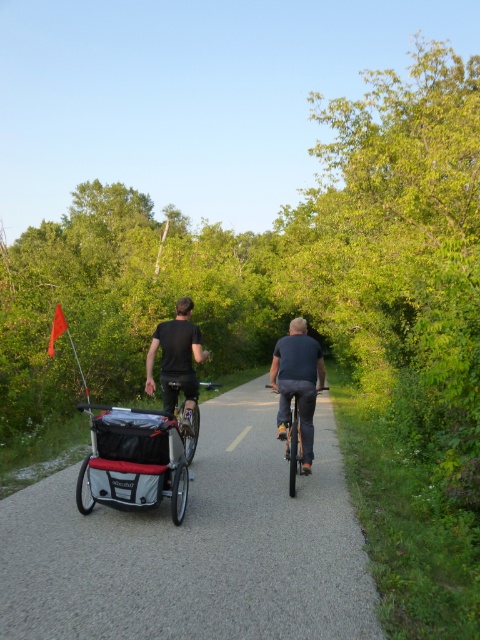
Question: Does shiny black bicycle at center have a greater width compared to shiny metallic bicycle at center?

Choices:
 (A) no
 (B) yes

Answer: (A)

Question: Is black matte shirt at center to the right of shiny black bicycle at center from the viewer's perspective?

Choices:
 (A) no
 (B) yes

Answer: (A)

Question: Which object appears farthest from the camera in this image?

Choices:
 (A) black matte shirt at center
 (B) black plastic cart at center
 (C) silver metallic cart at center
 (D) shiny metallic bicycle at center

Answer: (A)

Question: Does dark blue fabric shirt at center appear over shiny metallic bicycle at center?

Choices:
 (A) yes
 (B) no

Answer: (A)

Question: Which point is closer to the camera?

Choices:
 (A) dark blue fabric shirt at center
 (B) shiny metallic bicycle at center
 (C) black matte shirt at center

Answer: (B)

Question: Which point is closer to the camera taking this photo?

Choices:
 (A) (292, 492)
 (B) (267, 593)
 (C) (128, 500)
 (D) (189, 436)

Answer: (B)